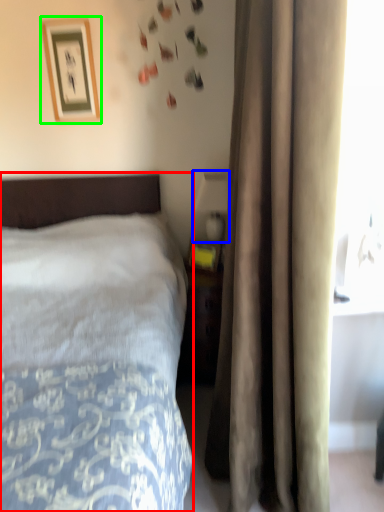
Question: Which object is positioned closest to bed (highlighted by a red box)? Select from table lamp (highlighted by a blue box) and picture frame (highlighted by a green box).

Choices:
 (A) table lamp
 (B) picture frame

Answer: (A)